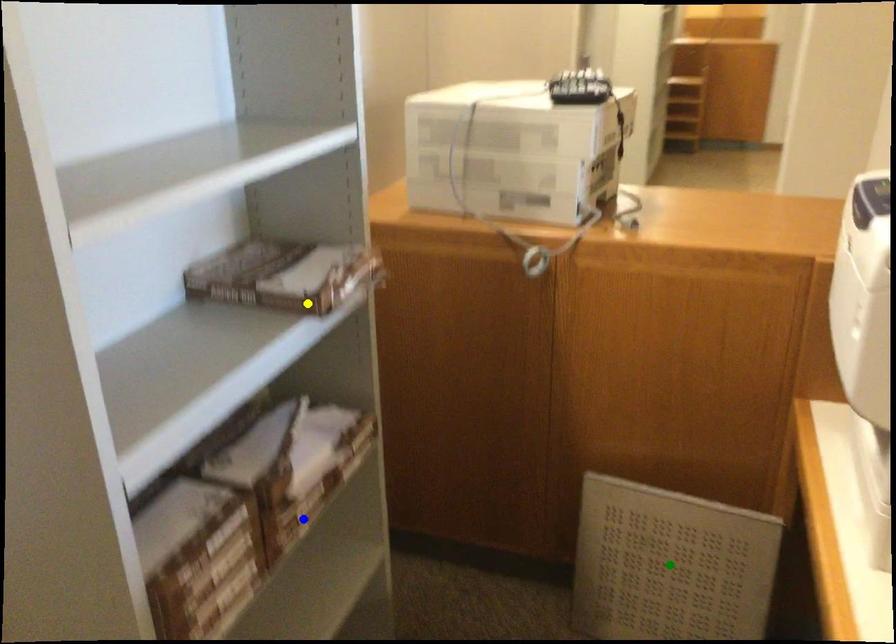
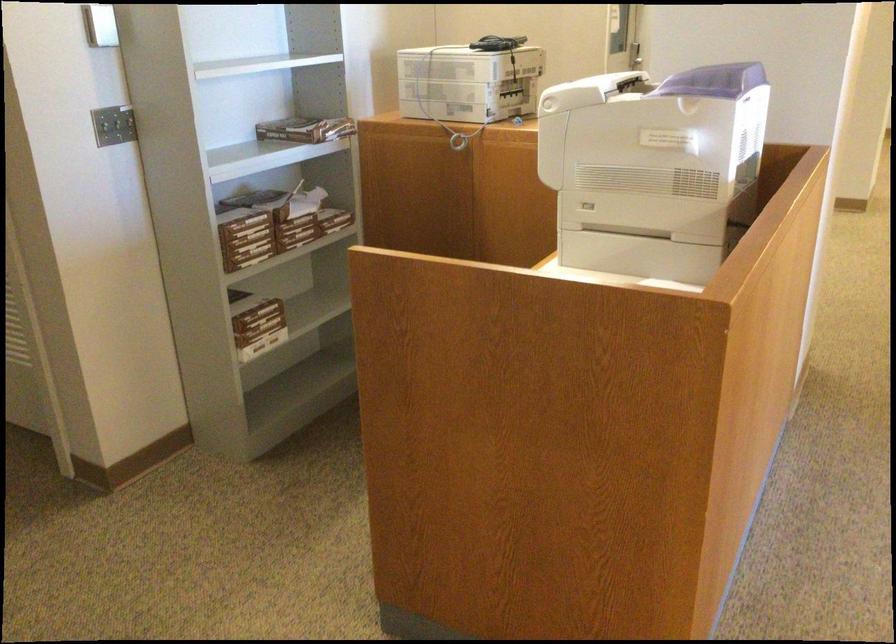
I am providing you with two images of the same scene from different viewpoints. Three points are marked in image1. Which point corresponds to a part or object that is occluded in image2?In image1, three points are marked. Which of them correspond to a part or object that is occluded in image2?Among the three points shown in image1, which one corresponds to a part or object that is no longer visible due to occlusion in image2?

Invisible in image2: green point.